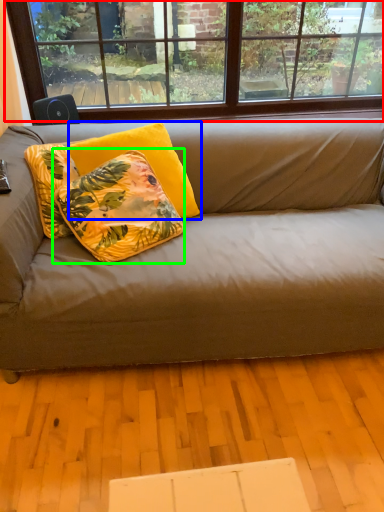
Question: Which object is positioned farthest from window (highlighted by a red box)? Select from pillow (highlighted by a blue box) and pillow (highlighted by a green box).

Choices:
 (A) pillow
 (B) pillow

Answer: (A)